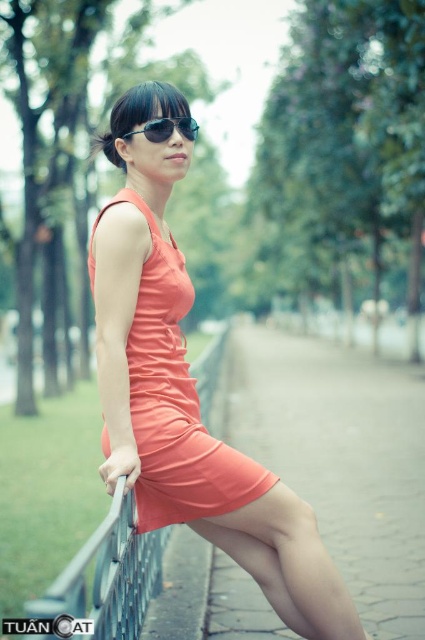
Question: Can you confirm if metallic gray fence at lower left is positioned below black reflective sunglasses at center?

Choices:
 (A) no
 (B) yes

Answer: (B)

Question: Which object appears closest to the camera in this image?

Choices:
 (A) metallic gray fence at lower left
 (B) matte orange dress at center
 (C) coral satin dress at center
 (D) black reflective sunglasses at center

Answer: (A)

Question: Which point appears closest to the camera in this image?

Choices:
 (A) (138, 593)
 (B) (130, 442)

Answer: (B)

Question: Which of the following is the farthest from the observer?

Choices:
 (A) metallic gray fence at lower left
 (B) matte orange dress at center
 (C) black reflective sunglasses at center
 (D) coral satin dress at center

Answer: (C)

Question: Can you confirm if coral satin dress at center is positioned to the right of metallic gray fence at lower left?

Choices:
 (A) no
 (B) yes

Answer: (B)

Question: Is the position of matte orange dress at center more distant than that of coral satin dress at center?

Choices:
 (A) no
 (B) yes

Answer: (A)